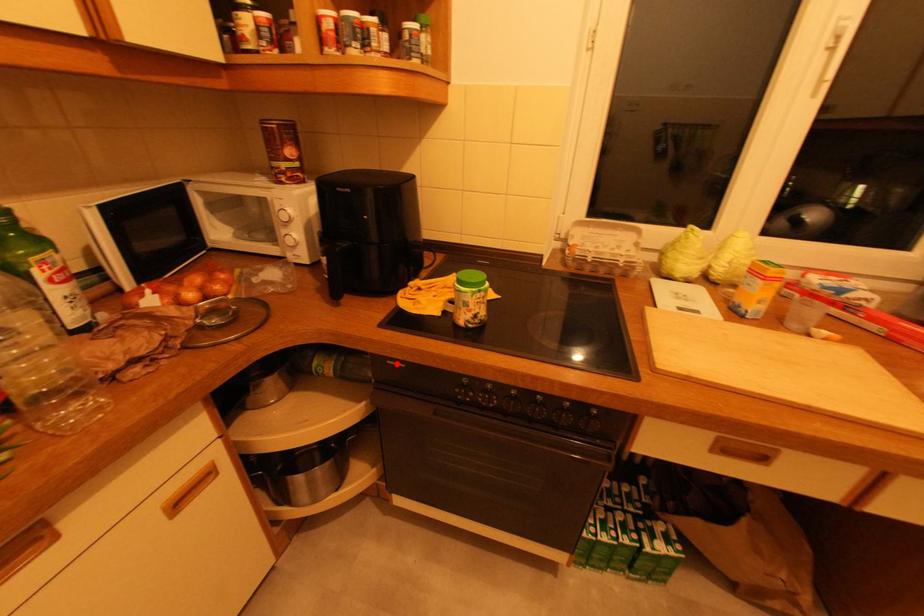
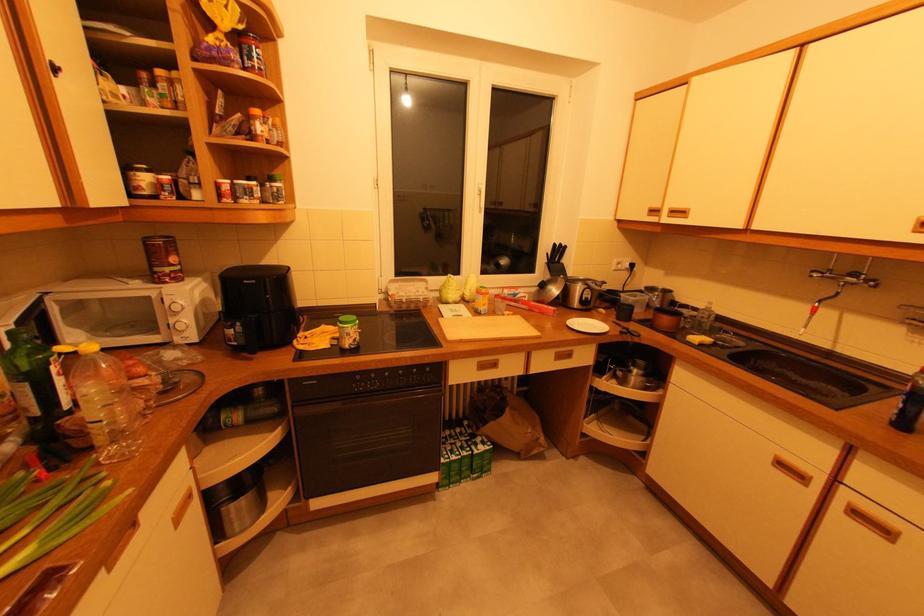
Locate, in the second image, the point that corresponds to the highlighted location in the first image.

(311, 383)